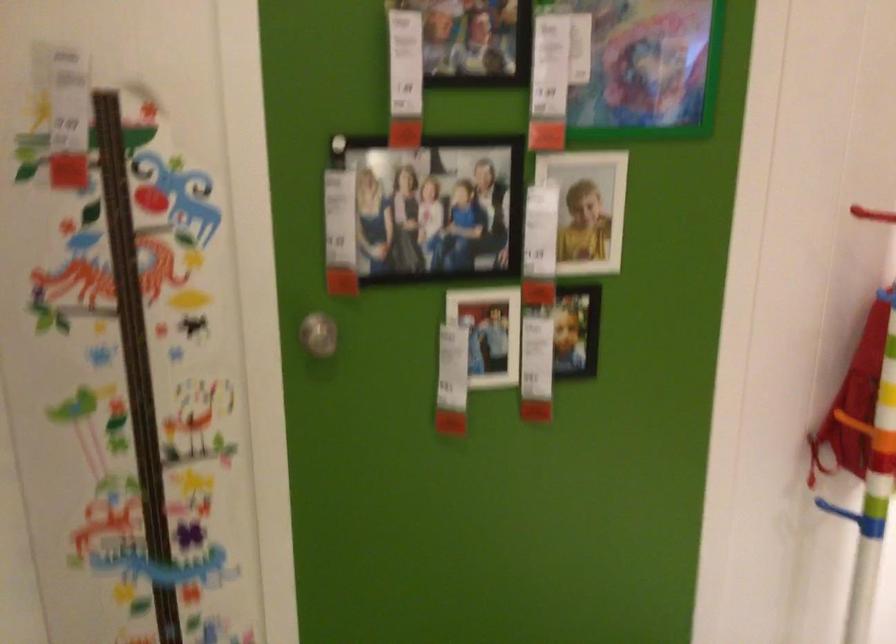
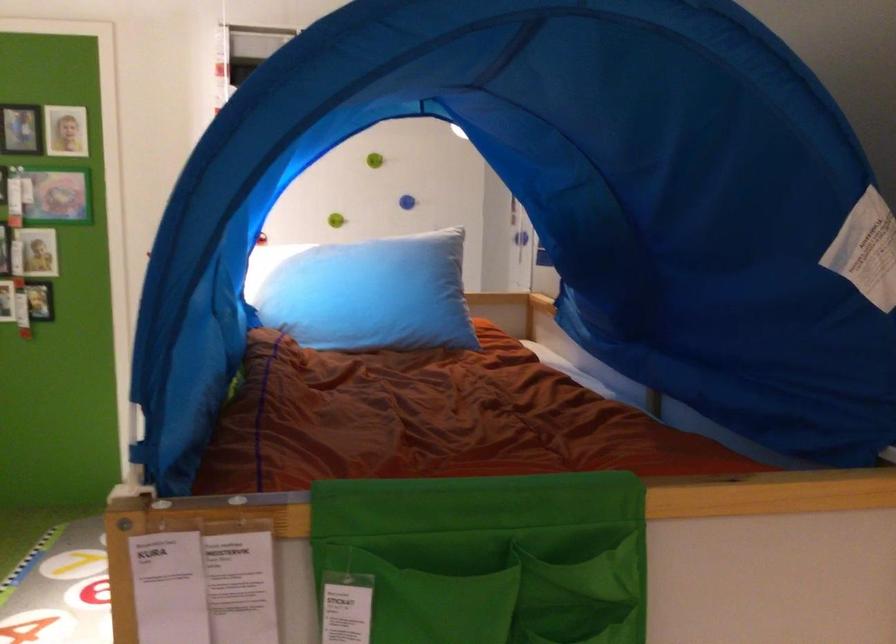
In the second image, find the point that corresponds to point 593,184 in the first image.

(39, 251)